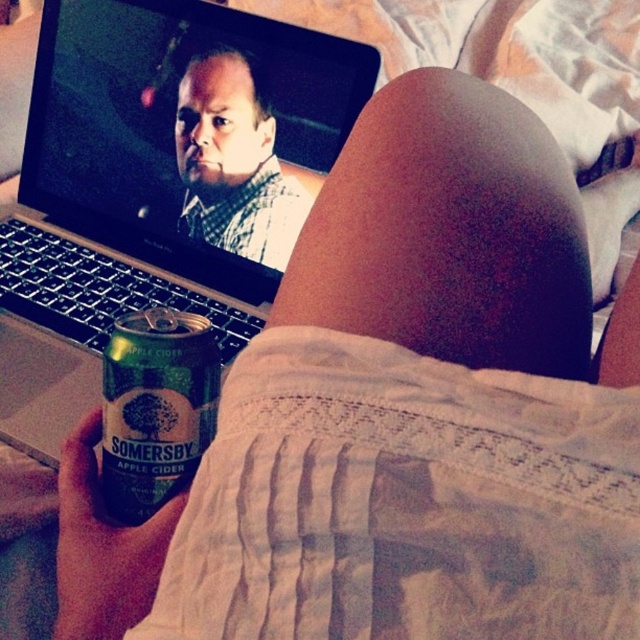
You are a delivery robot trying to reach the point marked at coordinates (269, 193). Your maximum reach distance is 30 inches. Can you reach that point?

The point marked at coordinates (269, 193) is 29.26 inches away from the camera, so yes, the delivery robot can reach it since it is within the maximum reach distance of 30 inches.

You are trying to reach for the matte black shirt at upper center while sitting in front of the silver metallic laptop at upper left. Which object will you touch first?

You will touch the silver metallic laptop at upper left first because it is closer to you than the matte black shirt at upper center.